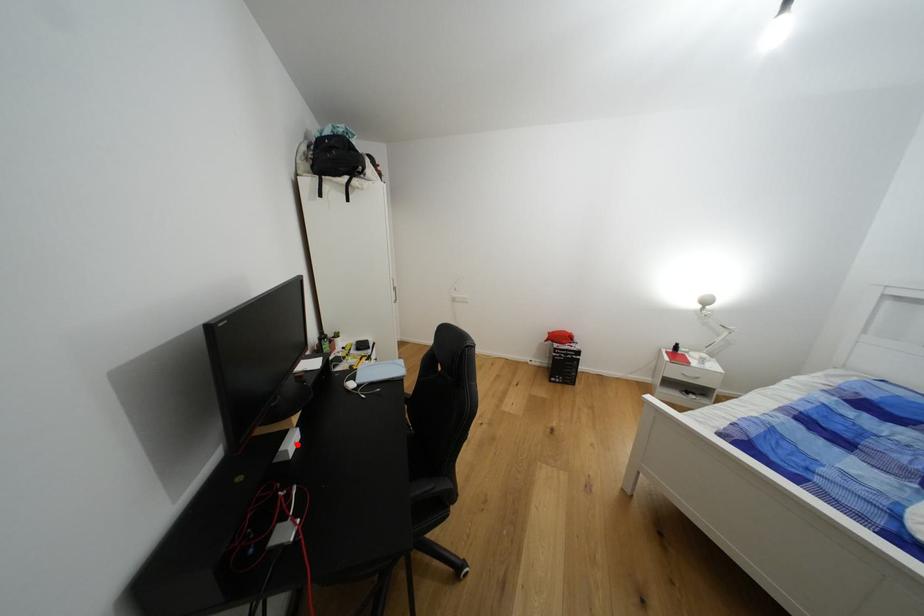
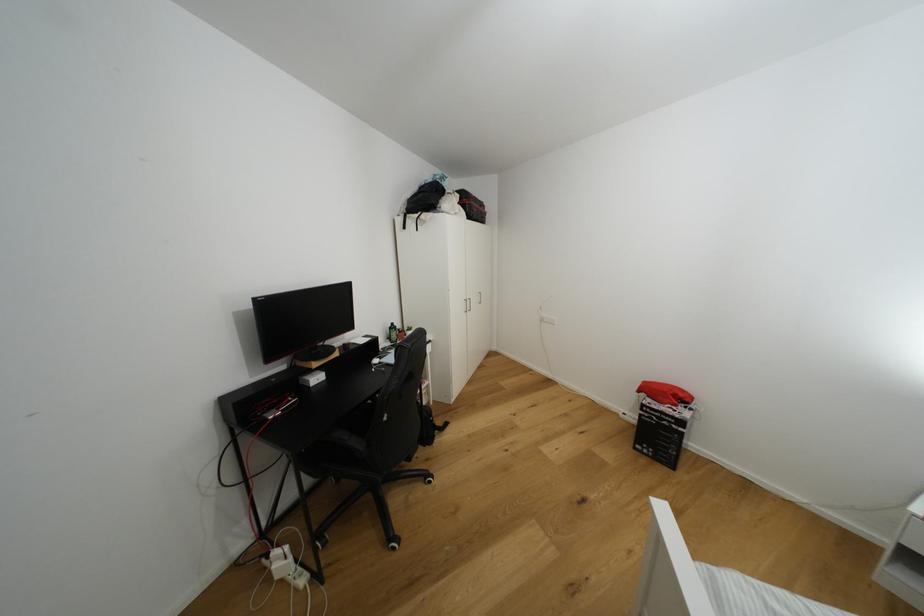
Question: I am providing you with two images of the same scene from different viewpoints. A red point is shown in image1. For the corresponding object point in image2, is it positioned nearer or farther from the camera?

Choices:
 (A) Nearer
 (B) Farther

Answer: (B)